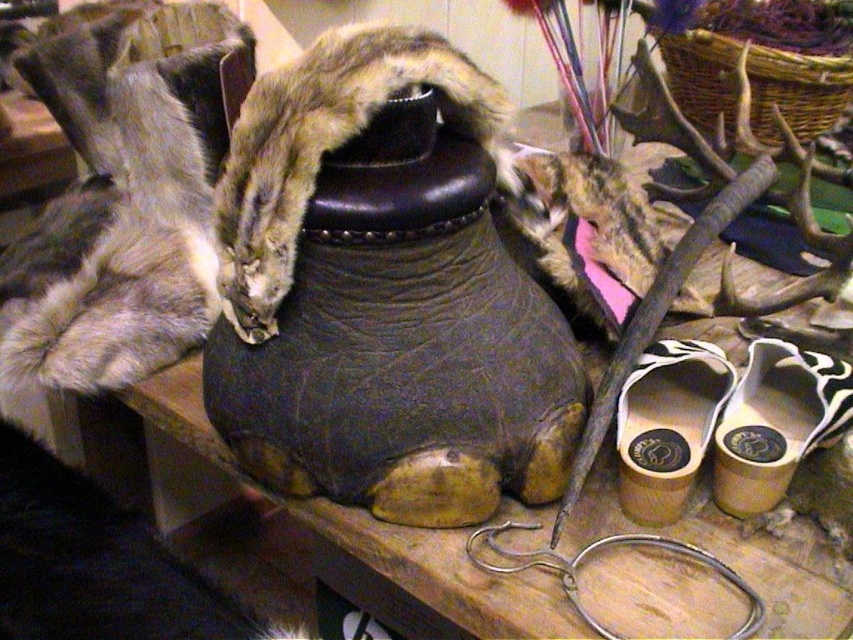
Question: Which point is farther to the camera?

Choices:
 (A) (728, 480)
 (B) (637, 371)

Answer: (B)

Question: In this image, where is white leather shoe at lower right located relative to wooden shoe at lower right?

Choices:
 (A) above
 (B) below

Answer: (B)

Question: Can you confirm if white leather shoe at lower right is positioned below wooden shoe at lower right?

Choices:
 (A) no
 (B) yes

Answer: (B)

Question: Which point is farther to the camera?

Choices:
 (A) white leather shoe at lower right
 (B) wooden shoe at lower right

Answer: (A)

Question: Does white leather shoe at lower right have a lesser width compared to wooden shoe at lower right?

Choices:
 (A) no
 (B) yes

Answer: (A)